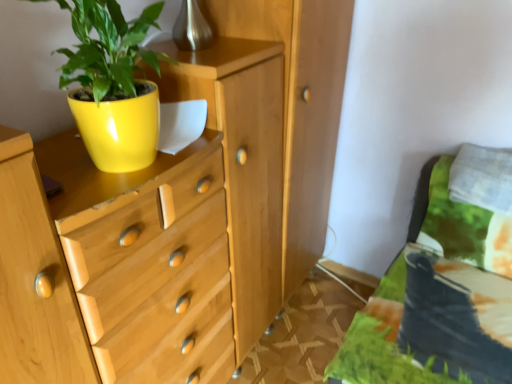
Question: From the image's perspective, is yellow glossy flowerpot at upper left located above matte yellow pot at upper left?

Choices:
 (A) yes
 (B) no

Answer: (A)

Question: Does yellow glossy flowerpot at upper left contain matte yellow pot at upper left?

Choices:
 (A) no
 (B) yes

Answer: (A)

Question: Can you confirm if yellow glossy flowerpot at upper left is wider than matte yellow pot at upper left?

Choices:
 (A) no
 (B) yes

Answer: (B)

Question: From a real-world perspective, does yellow glossy flowerpot at upper left stand above matte yellow pot at upper left?

Choices:
 (A) no
 (B) yes

Answer: (A)

Question: Does yellow glossy flowerpot at upper left have a larger size compared to matte yellow pot at upper left?

Choices:
 (A) yes
 (B) no

Answer: (B)

Question: From the image's perspective, is white soft pillow at upper right above or below yellow glossy flowerpot at upper left?

Choices:
 (A) above
 (B) below

Answer: (B)

Question: Considering the relative positions of white soft pillow at upper right and yellow glossy flowerpot at upper left in the image provided, is white soft pillow at upper right to the left or to the right of yellow glossy flowerpot at upper left?

Choices:
 (A) left
 (B) right

Answer: (B)

Question: From a real-world perspective, relative to yellow glossy flowerpot at upper left, is white soft pillow at upper right vertically above or below?

Choices:
 (A) above
 (B) below

Answer: (B)

Question: Looking at the image, does white soft pillow at upper right seem bigger or smaller compared to yellow glossy flowerpot at upper left?

Choices:
 (A) big
 (B) small

Answer: (A)

Question: From a real-world perspective, is white soft pillow at upper right above or below matte wood chest of drawers at left?

Choices:
 (A) above
 (B) below

Answer: (A)

Question: In terms of size, does white soft pillow at upper right appear bigger or smaller than matte wood chest of drawers at left?

Choices:
 (A) big
 (B) small

Answer: (B)

Question: Considering their positions, is white soft pillow at upper right located in front of or behind matte wood chest of drawers at left?

Choices:
 (A) behind
 (B) front

Answer: (A)

Question: Looking at their shapes, would you say white soft pillow at upper right is wider or thinner than matte wood chest of drawers at left?

Choices:
 (A) wide
 (B) thin

Answer: (B)

Question: Would you say matte wood chest of drawers at left is inside or outside white soft pillow at upper right?

Choices:
 (A) outside
 (B) inside

Answer: (A)

Question: Considering the positions of matte wood chest of drawers at left and white soft pillow at upper right in the image, is matte wood chest of drawers at left bigger or smaller than white soft pillow at upper right?

Choices:
 (A) big
 (B) small

Answer: (A)